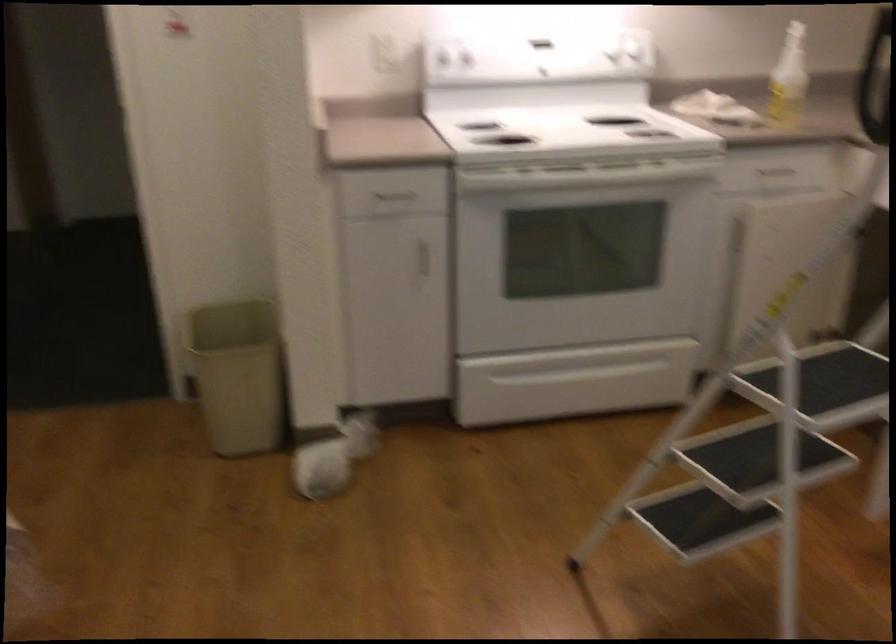
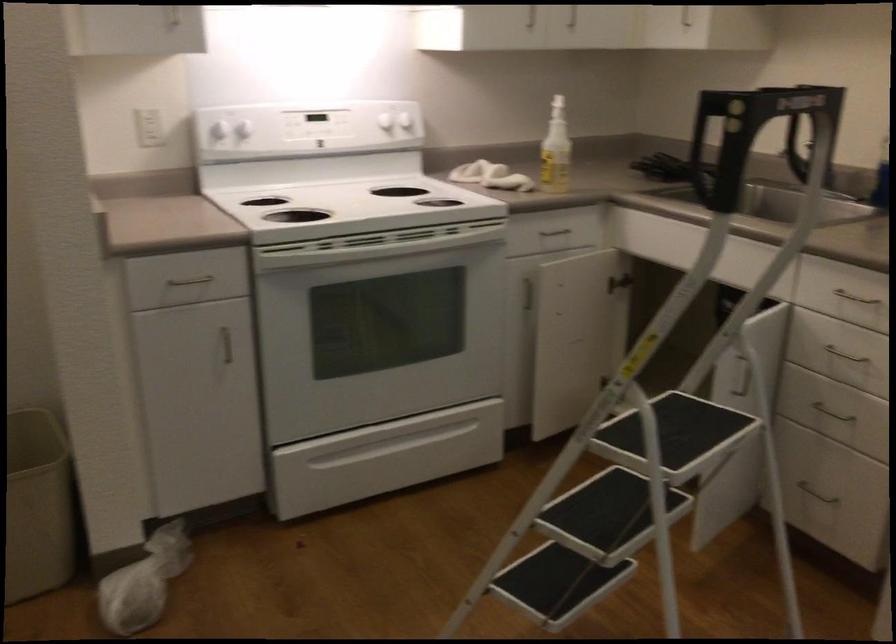
Find the pixel in the second image that matches point 423,256 in the first image.

(226, 345)